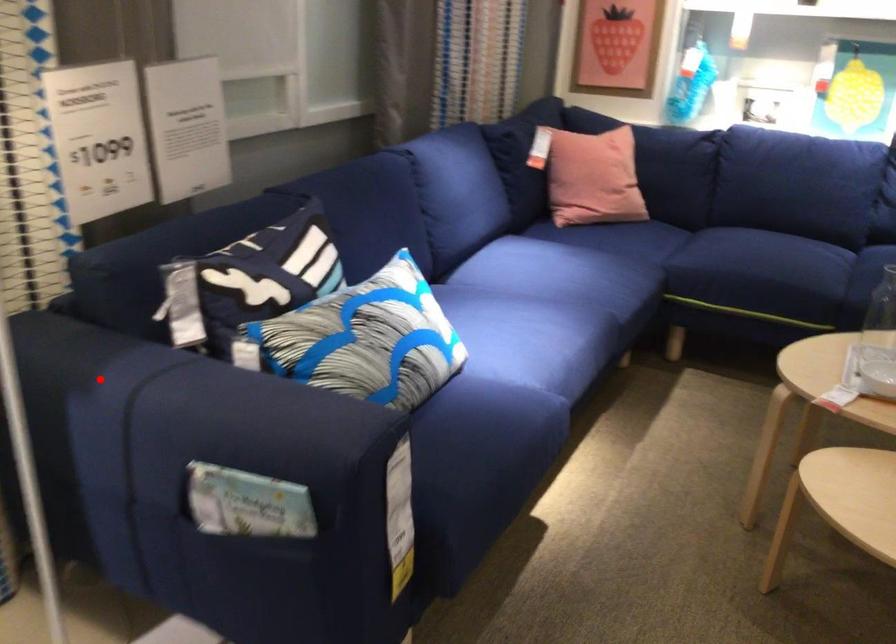
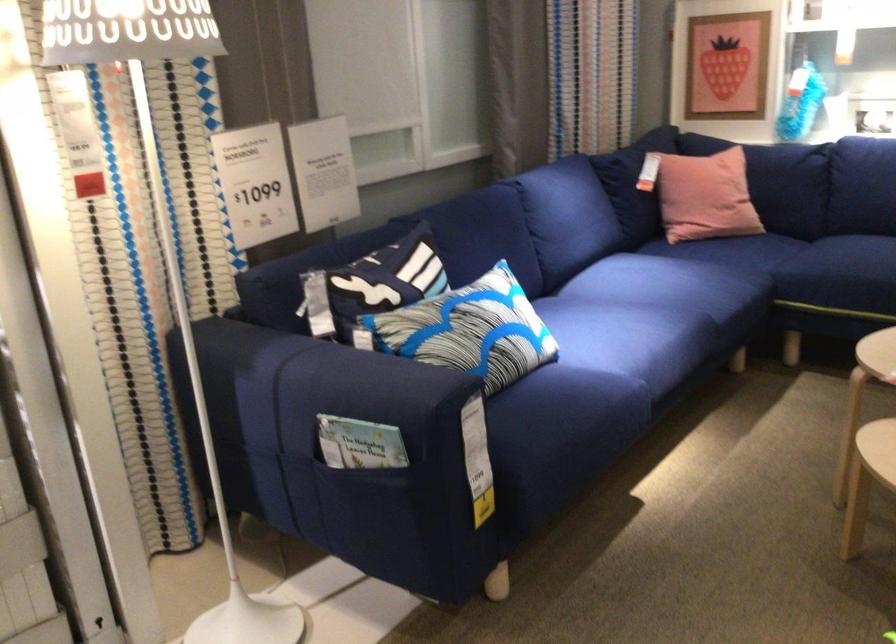
In the second image, find the point that corresponds to the highlighted location in the first image.

(254, 361)